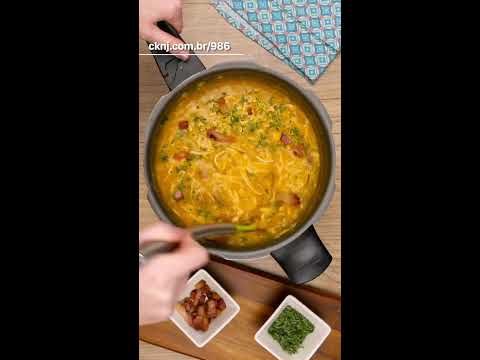
Locate an element on the screen. The image size is (480, 360). metal handle is located at coordinates (x=212, y=230).